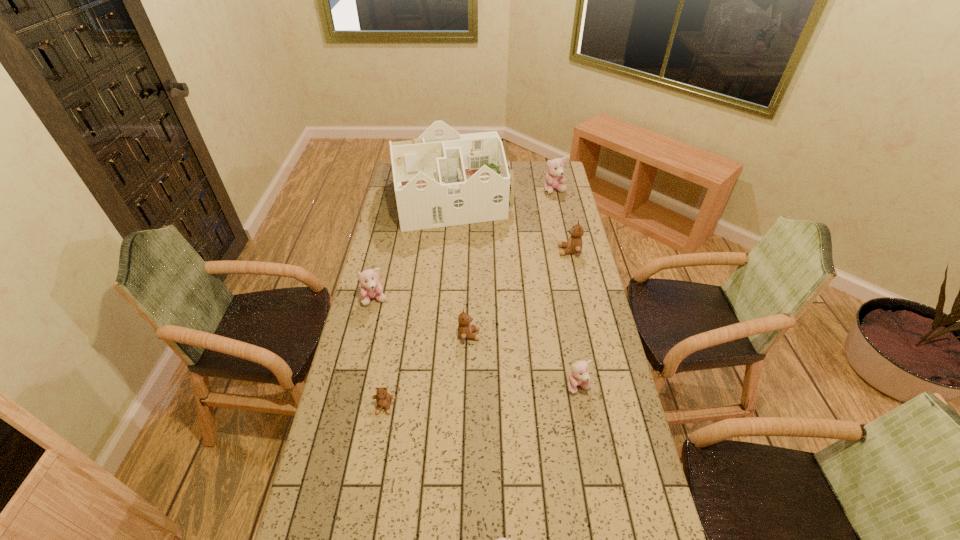
The width and height of the screenshot is (960, 540). I want to click on free space located on the front-facing side of the fourth nearest object, so click(x=546, y=335).

Locate an element on the screen. The width and height of the screenshot is (960, 540). vacant space positioned at the face of the third nearest teddy bear is located at coordinates (597, 489).

The width and height of the screenshot is (960, 540). Find the location of `vacant space situated 0.080m on the front-facing side of the leftmost brown teddy bear`. vacant space situated 0.080m on the front-facing side of the leftmost brown teddy bear is located at coordinates (379, 440).

The image size is (960, 540). I want to click on object at the far edge, so click(x=443, y=178).

I want to click on dollhouse situated at the left edge, so click(x=443, y=178).

Where is `object located at the far left corner`? object located at the far left corner is located at coordinates (443, 178).

Where is `vacant space at the right edge`? This screenshot has width=960, height=540. vacant space at the right edge is located at coordinates (540, 205).

Identify the location of vacant space at the far right corner of the desktop. The height and width of the screenshot is (540, 960). (544, 180).

Identify the location of free area in between the farthest brown teddy bear and the third nearest teddy bear. This screenshot has height=540, width=960. (574, 319).

This screenshot has width=960, height=540. In order to click on vacant area that lies between the leftmost pink teddy bear and the third biggest pink teddy bear in this screenshot , I will do [477, 343].